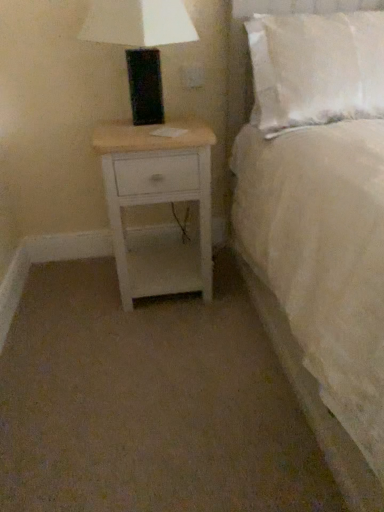
Identify the location of empty space that is in between white soft bed at upper right and white wood nightstand at lower left. (197, 373).